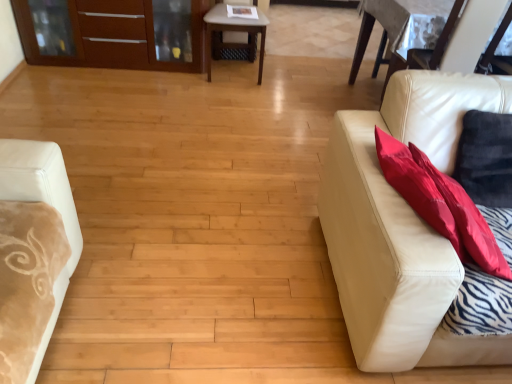
The image size is (512, 384). Identify the location of space that is in front of matte wood dresser at upper left. (109, 102).